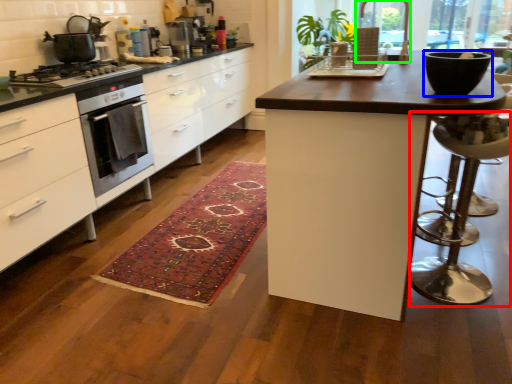
Question: Which is farther away from bar stool (highlighted by a red box)? bowl (highlighted by a blue box) or window screen (highlighted by a green box)?

Choices:
 (A) bowl
 (B) window screen

Answer: (B)